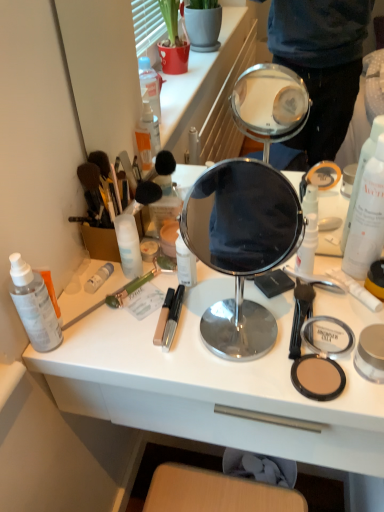
This screenshot has width=384, height=512. Find the location of `vacant area that is situated to the right of white matte tube at left, the 4th toiletry when ordered from right to left`. vacant area that is situated to the right of white matte tube at left, the 4th toiletry when ordered from right to left is located at coordinates (x=189, y=294).